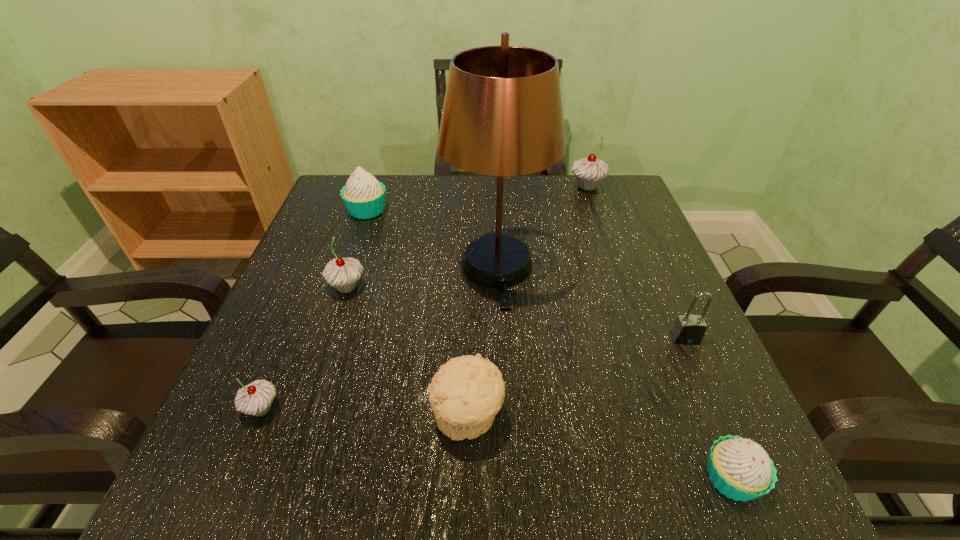
The image size is (960, 540). I want to click on the tallest object, so 502,116.

In order to click on the farthest cupcake in this screenshot , I will do `click(589, 171)`.

What are the coordinates of `the second tallest object` in the screenshot? It's located at (589, 171).

Where is `the third farthest cupcake`? This screenshot has height=540, width=960. the third farthest cupcake is located at coordinates (343, 274).

Locate an element on the screen. the second farthest gray cupcake is located at coordinates (343, 274).

In order to click on the left white cupcake in this screenshot , I will do `click(364, 197)`.

The height and width of the screenshot is (540, 960). Find the location of `the farther white cupcake`. the farther white cupcake is located at coordinates (364, 197).

This screenshot has width=960, height=540. In order to click on padlock in this screenshot , I will do `click(687, 329)`.

Find the location of a particular element. Image resolution: width=960 pixels, height=540 pixels. the fifth farthest object is located at coordinates (687, 329).

This screenshot has height=540, width=960. What are the coordinates of `beige muffin` in the screenshot? It's located at (467, 392).